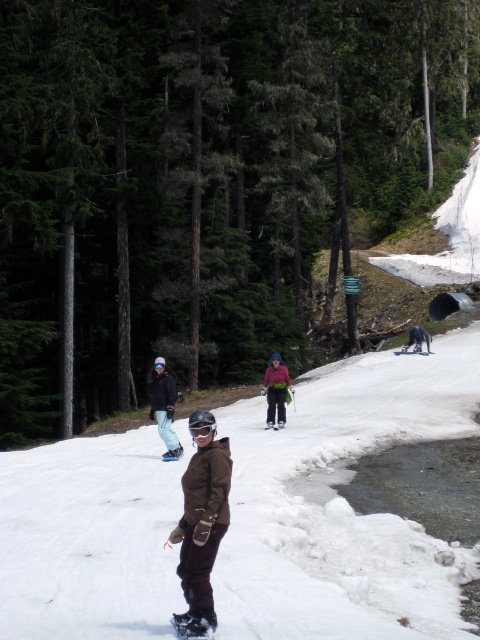
Between green matte tree at center and black matte snowboard at center, which one is positioned lower?

Positioned lower is black matte snowboard at center.

Does green matte tree at center have a greater height compared to black matte snowboard at center?

Correct, green matte tree at center is much taller as black matte snowboard at center.

The height and width of the screenshot is (640, 480). In order to click on green matte tree at center in this screenshot , I will do `click(203, 179)`.

Find the location of `green matte tree at center`. green matte tree at center is located at coordinates click(203, 179).

Does black matte snowboard at center have a smaller size compared to white matte snowboard at center?

Yes.

Who is more forward, (199, 612) or (414, 352)?

Point (199, 612) is in front.

Locate an element on the screen. Image resolution: width=480 pixels, height=640 pixels. black matte snowboard at center is located at coordinates (194, 624).

Who is taller, matte black snowboarder at center or black matte snowboard at center?

matte black snowboarder at center

Is matte black snowboarder at center to the right of black matte snowboard at center from the viewer's perspective?

No, matte black snowboarder at center is not to the right of black matte snowboard at center.

You are a GUI agent. You are given a task and a screenshot of the screen. Output one action in this format:
    pyautogui.click(x=<x>, y=<y>)
    Task: Click on the matte black snowboarder at center
    The height and width of the screenshot is (640, 480).
    Given the screenshot: What is the action you would take?
    pyautogui.click(x=165, y=408)